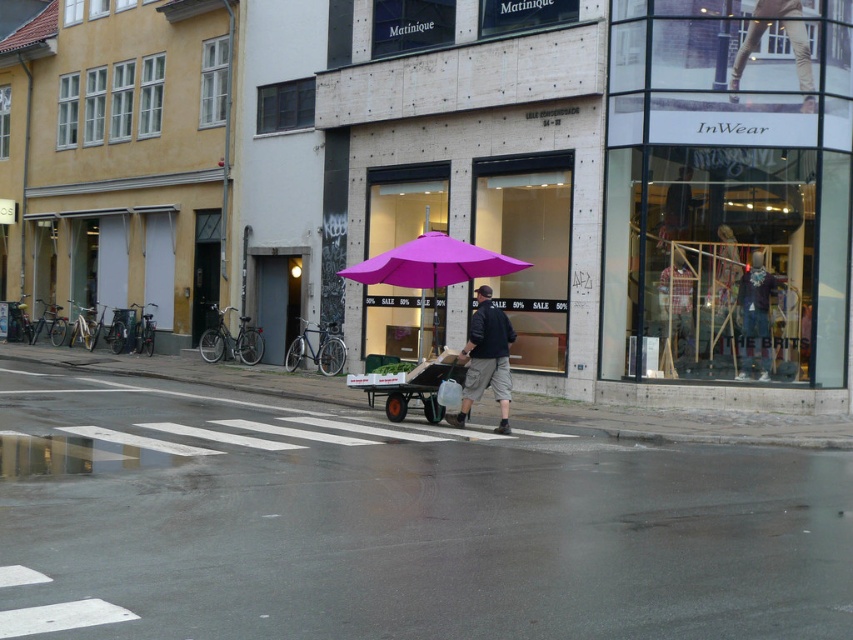
Question: Can you confirm if purple matte umbrella at center is positioned below denim jacket at center?

Choices:
 (A) no
 (B) yes

Answer: (A)

Question: Considering the real-world distances, which object is farthest from the wooden cart at center?

Choices:
 (A) dark blue cotton shirt at center
 (B) denim jacket at center
 (C) purple matte umbrella at center
 (D) gray asphalt at center

Answer: (B)

Question: Among these points, which one is farthest from the camera?

Choices:
 (A) pyautogui.click(x=463, y=376)
 (B) pyautogui.click(x=225, y=371)
 (C) pyautogui.click(x=442, y=250)

Answer: (B)

Question: Is purple matte umbrella at center positioned at the back of wooden cart at center?

Choices:
 (A) yes
 (B) no

Answer: (B)

Question: Which of the following is the farthest from the observer?

Choices:
 (A) (763, 371)
 (B) (422, 387)

Answer: (A)

Question: Does gray asphalt at center have a lesser width compared to purple matte umbrella at center?

Choices:
 (A) no
 (B) yes

Answer: (A)